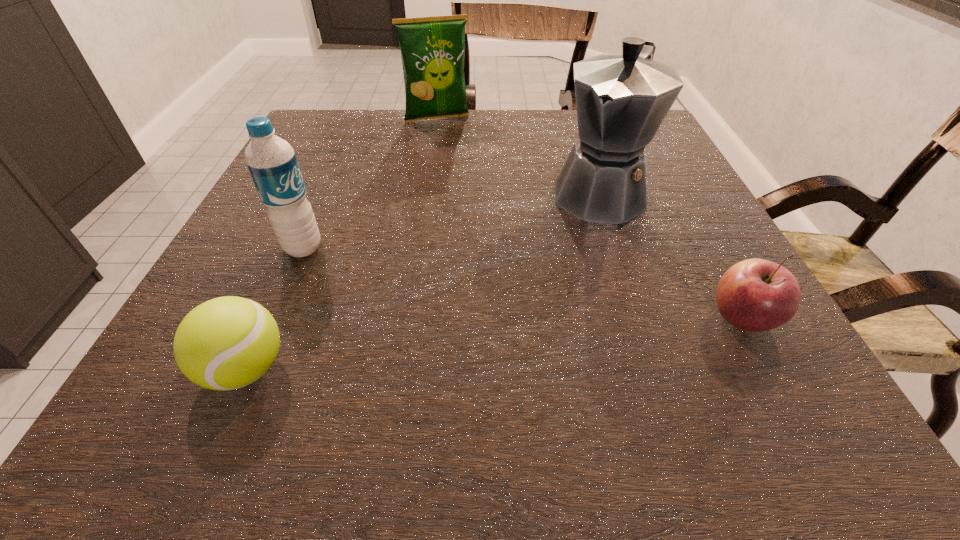
Identify the location of tennis ball. The width and height of the screenshot is (960, 540). (225, 343).

The image size is (960, 540). What are the coordinates of `the rightmost object` in the screenshot? It's located at (756, 295).

Identify the location of water bottle. (271, 161).

Image resolution: width=960 pixels, height=540 pixels. In order to click on the tallest object in this screenshot , I will do `click(621, 100)`.

Where is `the fourth nearest object`? The image size is (960, 540). the fourth nearest object is located at coordinates (621, 100).

You are a GUI agent. You are given a task and a screenshot of the screen. Output one action in this format:
    pyautogui.click(x=<x>, y=<y>)
    Task: Click on the farthest object
    
    Given the screenshot: What is the action you would take?
    coord(432,49)

Locate an element on the screen. The height and width of the screenshot is (540, 960). the third object from right to left is located at coordinates (432, 49).

What are the coordinates of `free spot located on the right of the tennis ball` in the screenshot? It's located at (441, 369).

In order to click on blank space located on the left of the apple in this screenshot , I will do [x=473, y=319].

Where is `free space located 0.320m on the label of the water bottle`? The image size is (960, 540). free space located 0.320m on the label of the water bottle is located at coordinates (482, 312).